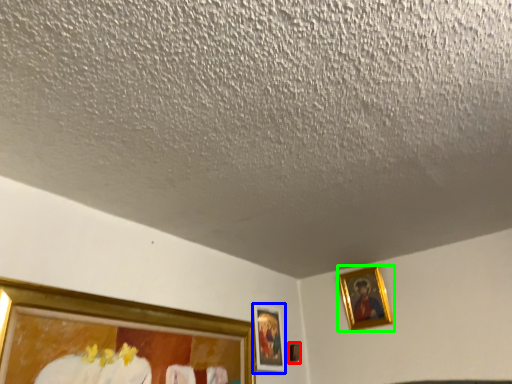
Question: Which is farther away from picture frame (highlighted by a red box)? picture frame (highlighted by a blue box) or picture frame (highlighted by a green box)?

Choices:
 (A) picture frame
 (B) picture frame

Answer: (B)